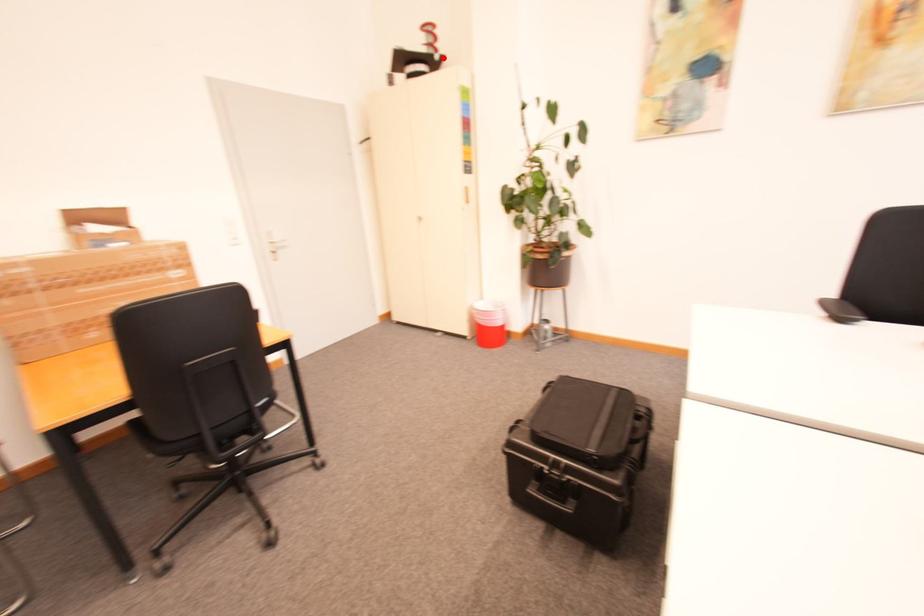
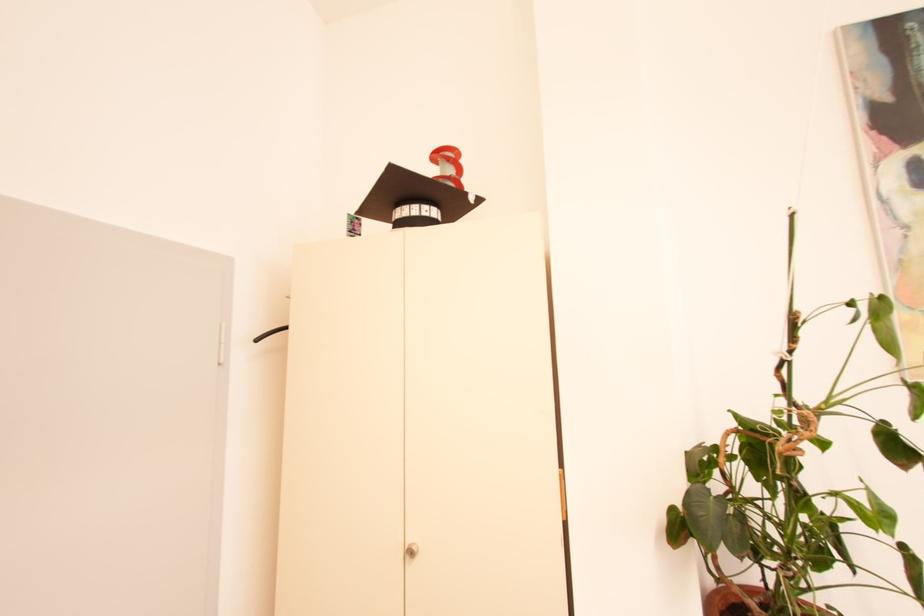
Question: I am providing you with two images of the same scene from different viewpoints. A red point is marked on the first image. Is the red point's position out of view in image 2?

Choices:
 (A) Yes
 (B) No

Answer: (B)